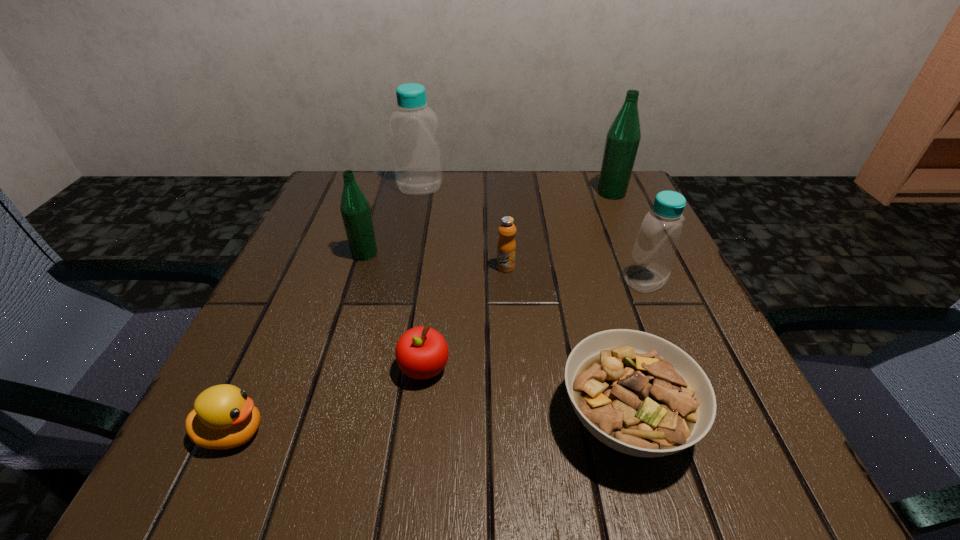
This screenshot has width=960, height=540. Identify the location of free space located 0.190m on the face of the duckling. (409, 433).

Identify the location of vacant region located on the back of the gray stew. (588, 283).

Where is `duckling that is positioned at the near edge`? This screenshot has height=540, width=960. duckling that is positioned at the near edge is located at coordinates (224, 417).

The height and width of the screenshot is (540, 960). I want to click on stew at the near edge, so click(x=639, y=394).

I want to click on bottle that is at the left edge, so click(355, 209).

Identify the location of duckling at the left edge. The height and width of the screenshot is (540, 960). (224, 417).

In order to click on stew at the right edge in this screenshot , I will do (x=639, y=394).

The width and height of the screenshot is (960, 540). Find the location of `object that is at the near left corner`. object that is at the near left corner is located at coordinates (224, 417).

Locate an element on the screen. The width and height of the screenshot is (960, 540). object that is at the far right corner is located at coordinates (623, 138).

Locate an element on the screen. object located in the near right corner section of the desktop is located at coordinates (639, 394).